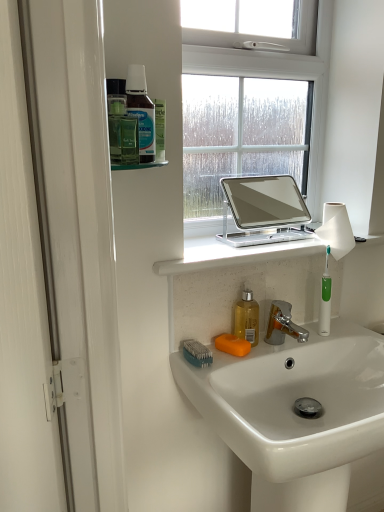
Question: In terms of width, does translucent yellow liquid at sink, positioned as the 2th mouthwash in top-to-bottom order, look wider or thinner when compared to orange matte soap at sink?

Choices:
 (A) wide
 (B) thin

Answer: (B)

Question: From a real-world perspective, is translucent yellow liquid at sink, which is the first mouthwash from bottom to top, above or below orange matte soap at sink?

Choices:
 (A) below
 (B) above

Answer: (B)

Question: Estimate the real-world distances between objects in this image. Which object is farther from the translucent plastic bottle at upper left, the 1th mouthwash positioned from the front?

Choices:
 (A) white stone window sill at center
 (B) orange matte soap at sink
 (C) green plastic toothbrush at lower center
 (D) green plastic toothbrush at right
 (E) white glossy sink at lower center

Answer: (E)

Question: Estimate the real-world distances between objects in this image. Which object is closer to the green plastic toothbrush at lower center?

Choices:
 (A) translucent yellow liquid at sink, acting as the 1th mouthwash starting from the back
 (B) green plastic toothbrush at right
 (C) white glossy sink at lower center
 (D) white stone window sill at center
 (E) orange matte soap at sink

Answer: (E)